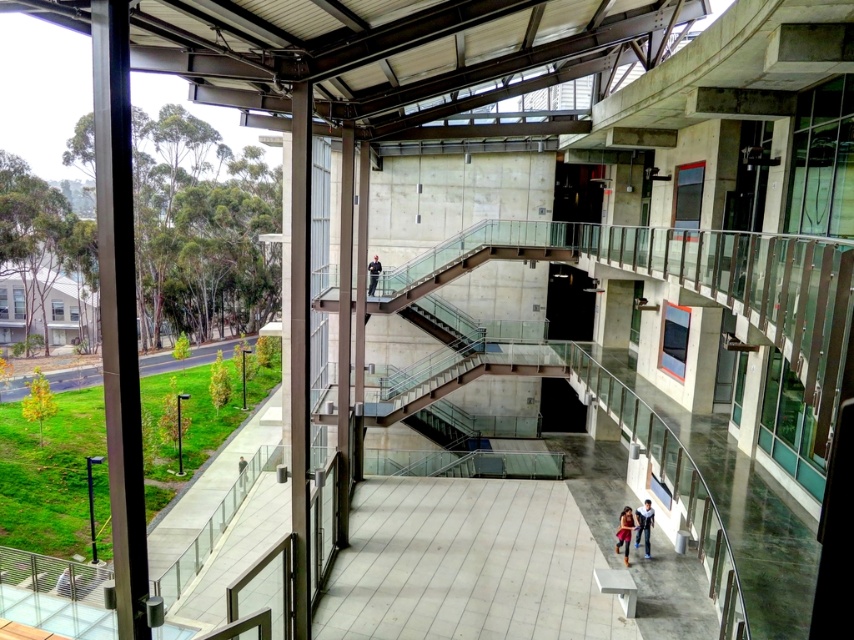
You are standing in the atrium and want to pick up an item. You see the blue jeans at lower center and the matte black jacket at lower center. Which item is closer to you?

The blue jeans at lower center is closer to you because the matte black jacket at lower center is behind it.

You are standing in the atrium of a modern building and see the blue jeans at lower center. If you want to take a photo of the blue jeans from the exact center of the atrium, which direction should you move to position yourself correctly? Please provide your answer as a cardinal direction like north, south, east, or west.

Since the blue jeans at lower center is located at point 0.822 on the x axis and 0.755 on the y axis, moving west would align you with the correct position to photograph it from the center of the atrium.

Consider the image. You are an event planner setting up for a formal gathering in the atrium. You need to place a coat rack that can accommodate both the matte black jacket at lower center and the dark blue uniform at center. Considering their sizes, which of the two items requires more space on the rack?

The dark blue uniform at center requires more space on the rack since it is larger than the matte black jacket at lower center.